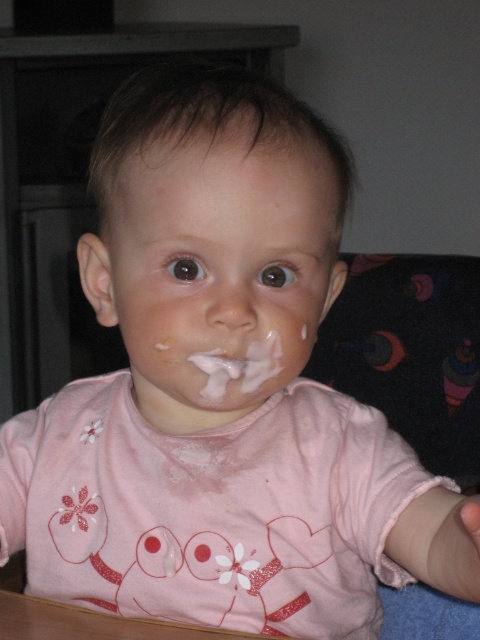
Is the position of white matte face at center less distant than that of white creamy frosting at mouth?

Yes, it is.

Based on the photo, between white matte face at center and white creamy frosting at mouth, which one is positioned lower?

white creamy frosting at mouth is lower down.

Between point (118, 252) and point (252, 376), which one is positioned behind?

Point (118, 252)

Where is `white matte face at center`? white matte face at center is located at coordinates (222, 269).